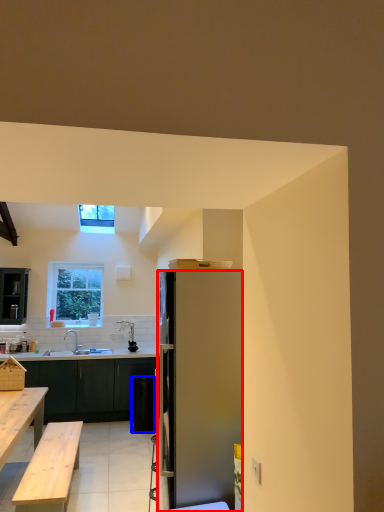
Question: Which of the following is the farthest to the observer, refrigerator (highlighted by a red box) or trash bin/can (highlighted by a blue box)?

Choices:
 (A) refrigerator
 (B) trash bin/can

Answer: (B)